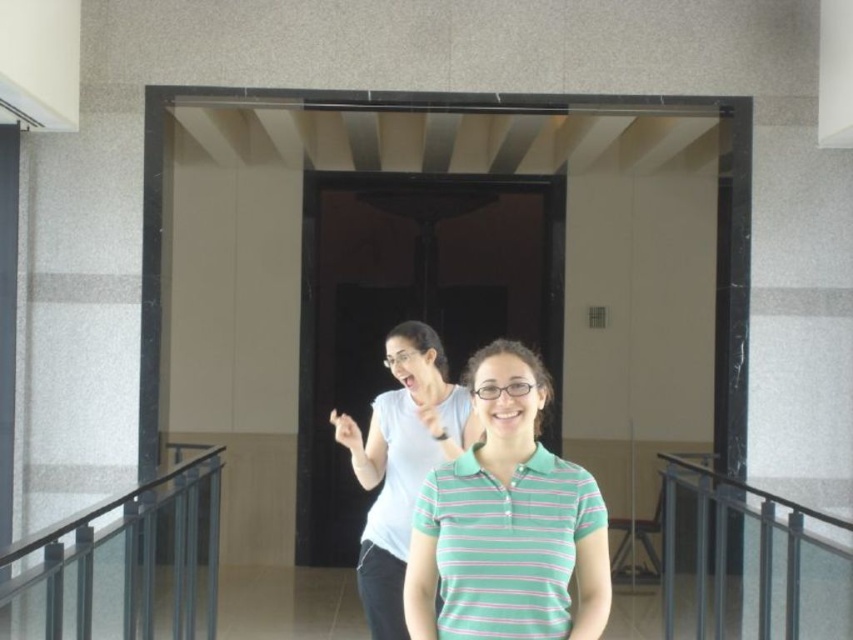
Who is more forward, (422, 604) or (747, 497)?

Point (422, 604) is more forward.

Locate an element on the screen. green striped polo shirt at center is located at coordinates (508, 524).

What do you see at coordinates (508, 524) in the screenshot? I see `green striped polo shirt at center` at bounding box center [508, 524].

I want to click on green striped polo shirt at center, so click(508, 524).

Is white matte shirt at center taller than metallic gray railing at lower right?

No, white matte shirt at center is not taller than metallic gray railing at lower right.

Between point (372, 634) and point (819, 515), which one is positioned behind?

Positioned behind is point (819, 515).

What are the coordinates of `white matte shirt at center` in the screenshot? It's located at (401, 461).

Is point (474, 355) farther from viewer compared to point (471, 412)?

Yes, point (474, 355) is behind point (471, 412).

Measure the distance between green striped polo shirt at center and camera.

green striped polo shirt at center is 6.22 feet away from camera.

Does point (573, 518) lie in front of point (473, 420)?

Yes, it is in front of point (473, 420).

The width and height of the screenshot is (853, 640). What are the coordinates of `green striped polo shirt at center` in the screenshot? It's located at (508, 524).